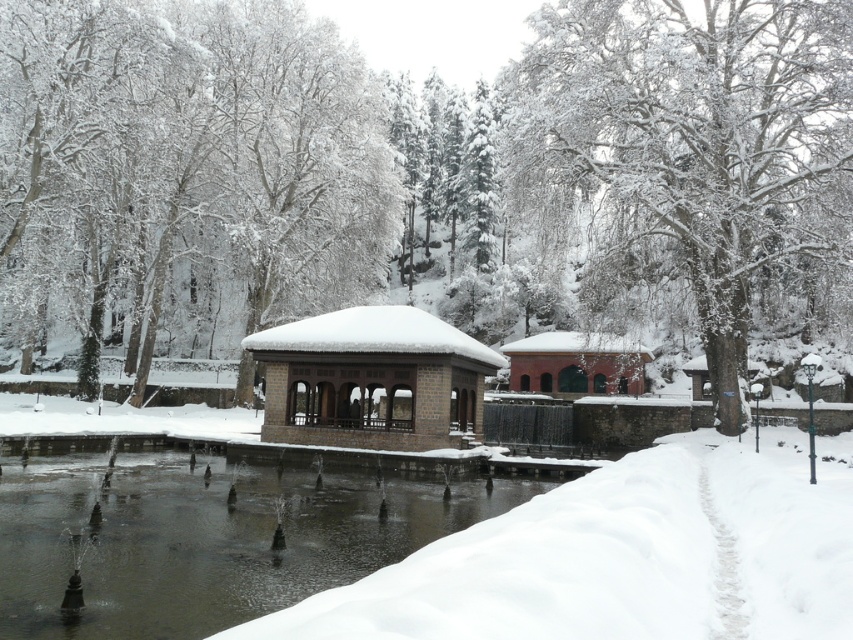
Who is higher up, white fluffy snow at lower left or brick textured building at center?

brick textured building at center

Does white fluffy snow at lower left have a greater height compared to brick textured building at center?

No, white fluffy snow at lower left is not taller than brick textured building at center.

What are the coordinates of `white fluffy snow at lower left` in the screenshot? It's located at (622, 557).

The image size is (853, 640). I want to click on white fluffy snow at lower left, so click(622, 557).

Is white brick gazebo at center behind brick textured building at center?

No, white brick gazebo at center is in front of brick textured building at center.

What do you see at coordinates (372, 380) in the screenshot? I see `white brick gazebo at center` at bounding box center [372, 380].

Find the location of a particular element. white brick gazebo at center is located at coordinates pos(372,380).

Can you confirm if snow-covered tree at center is bigger than white brick gazebo at center?

Yes, snow-covered tree at center is bigger than white brick gazebo at center.

From the picture: Who is higher up, snow-covered tree at center or white brick gazebo at center?

snow-covered tree at center

Which is in front, point (770, 92) or point (440, 448)?

Point (440, 448) is more forward.

In order to click on snow-covered tree at center in this screenshot , I will do `click(691, 145)`.